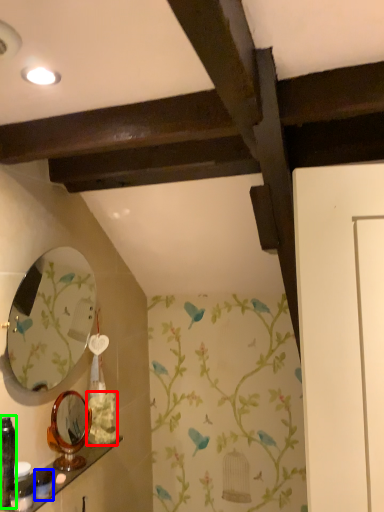
Question: Estimate the real-world distances between objects in this image. Which object is farther from flower (highlighted by a red box), toiletry (highlighted by a blue box) or toiletry (highlighted by a green box)?

Choices:
 (A) toiletry
 (B) toiletry

Answer: (B)